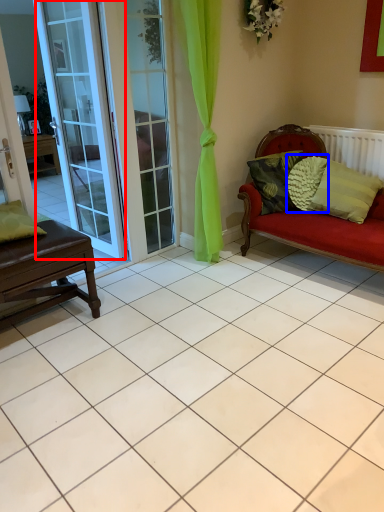
Question: Which object is further to the camera taking this photo, door (highlighted by a red box) or pillow (highlighted by a blue box)?

Choices:
 (A) door
 (B) pillow

Answer: (B)